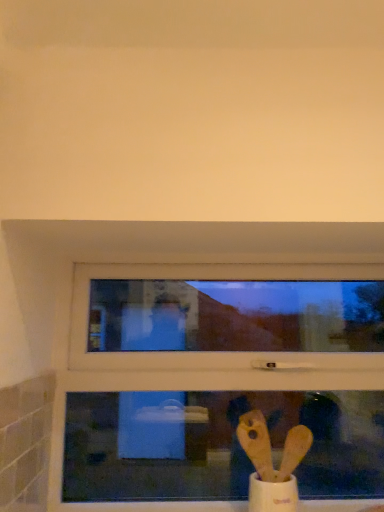
What do you see at coordinates (149, 270) in the screenshot? I see `transparent glass window at center` at bounding box center [149, 270].

The height and width of the screenshot is (512, 384). I want to click on transparent glass window at center, so click(x=149, y=270).

The height and width of the screenshot is (512, 384). Identify the location of transparent glass window at center. (149, 270).